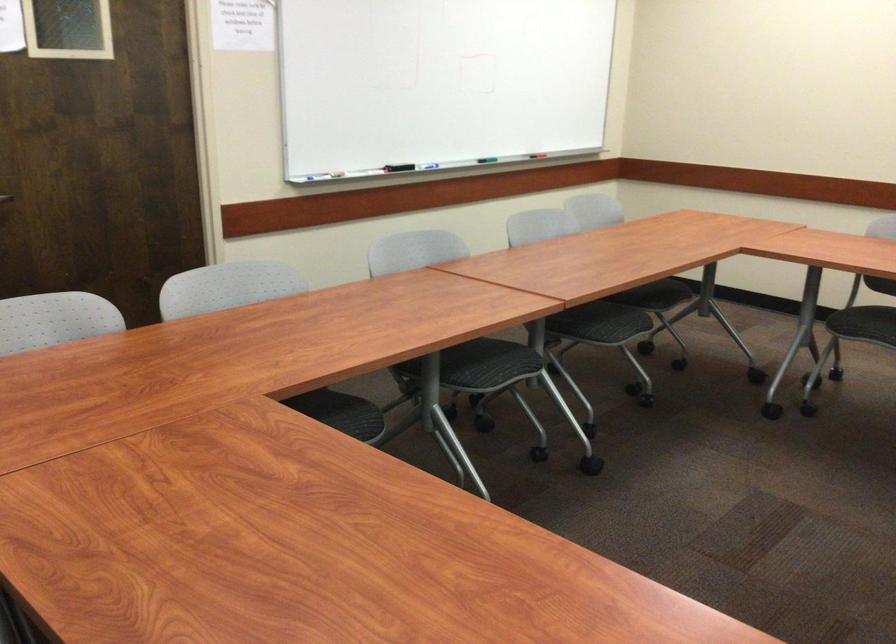
In order to click on metal door handle in this screenshot , I will do `click(5, 198)`.